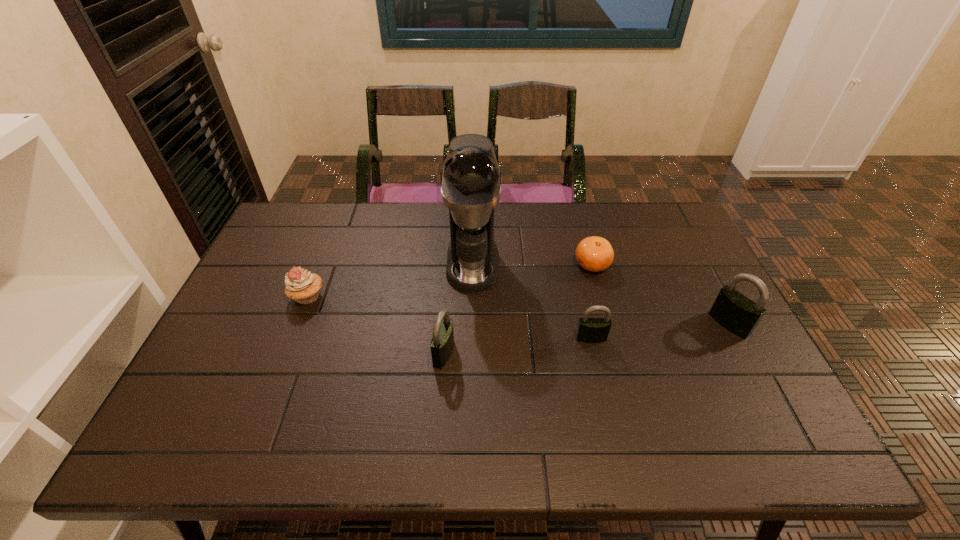
Please point a spot on the left to add another padlock. Please provide its 2D coordinates. Your answer should be formatted as a tuple, i.e. [(x, y)], where the tuple contains the x and y coordinates of a point satisfying the conditions above.

[(287, 369)]